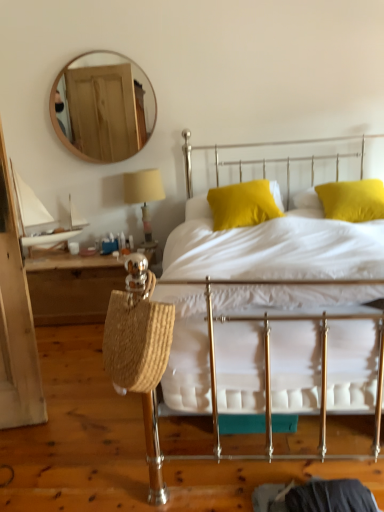
Question: Considering the positions of beige fabric lampshade at upper center and white cotton bed at center in the image, is beige fabric lampshade at upper center wider or thinner than white cotton bed at center?

Choices:
 (A) wide
 (B) thin

Answer: (B)

Question: From a real-world perspective, relative to white cotton bed at center, is beige fabric lampshade at upper center vertically above or below?

Choices:
 (A) below
 (B) above

Answer: (B)

Question: Which of these objects is positioned closest to the yellow fabric pillow at center, which is counted as the 2th pillow, starting from the right?

Choices:
 (A) wooden round mirror at upper left
 (B) matte yellow pillow at upper right, which is the 2th pillow in left-to-right order
 (C) beige fabric lampshade at upper center
 (D) white cotton bed at center
 (E) woven straw bag at left

Answer: (B)

Question: Considering the real-world distances, which object is farthest from the beige fabric lampshade at upper center?

Choices:
 (A) white cotton bed at center
 (B) woven straw bag at left
 (C) wooden round mirror at upper left
 (D) yellow fabric pillow at center, which appears as the first pillow when viewed from the left
 (E) matte yellow pillow at upper right, arranged as the 1th pillow when viewed from the right

Answer: (A)